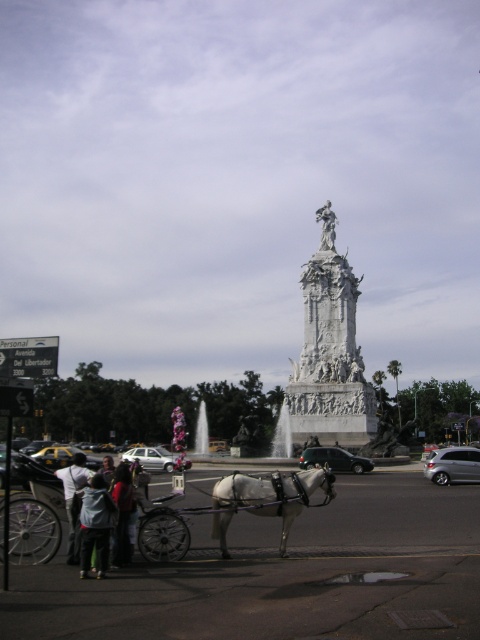
Is satin silver sedan at lower right shorter than white cotton shirt at lower left?

Indeed, satin silver sedan at lower right has a lesser height compared to white cotton shirt at lower left.

Between satin silver sedan at lower right and white cotton shirt at lower left, which one has more height?

white cotton shirt at lower left

Is point (435, 464) positioned after point (57, 476)?

That is True.

Identify the location of satin silver sedan at lower right. (453, 465).

Is satin silver sedan at lower right smaller than white marble statue at upper center?

No, satin silver sedan at lower right is not smaller than white marble statue at upper center.

Can you confirm if satin silver sedan at lower right is wider than white marble statue at upper center?

Correct, the width of satin silver sedan at lower right exceeds that of white marble statue at upper center.

Who is more forward, (x=447, y=451) or (x=327, y=250)?

Positioned in front is point (x=447, y=451).

The image size is (480, 640). In order to click on satin silver sedan at lower right in this screenshot , I will do `click(453, 465)`.

Is point (313, 456) positioned behind point (327, 220)?

No, it is not.

In order to click on metallic silver car at center in this screenshot , I will do [334, 460].